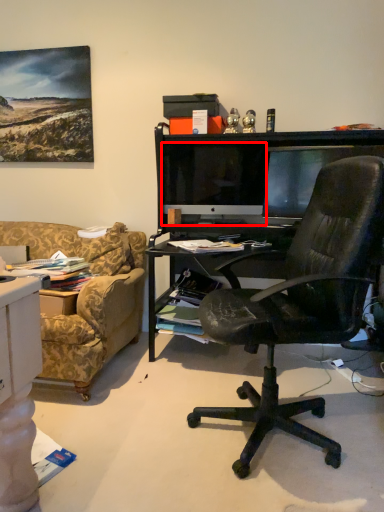
Question: From the image's perspective, what is the correct spatial relationship of computer monitor (annotated by the red box) in relation to computer monitor?

Choices:
 (A) below
 (B) above

Answer: (B)